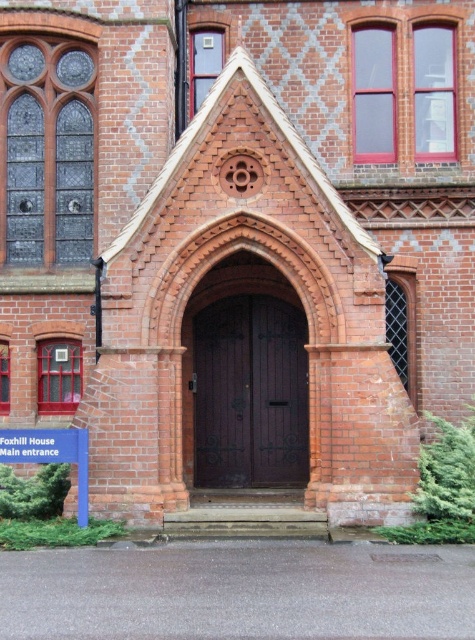
Consider the image. Between dark wood door at center and blue plastic sign at lower left, which one has more height?

dark wood door at center is taller.

Is dark wood door at center above blue plastic sign at lower left?

Correct, dark wood door at center is located above blue plastic sign at lower left.

The width and height of the screenshot is (475, 640). What do you see at coordinates (249, 394) in the screenshot? I see `dark wood door at center` at bounding box center [249, 394].

The image size is (475, 640). Identify the location of dark wood door at center. (249, 394).